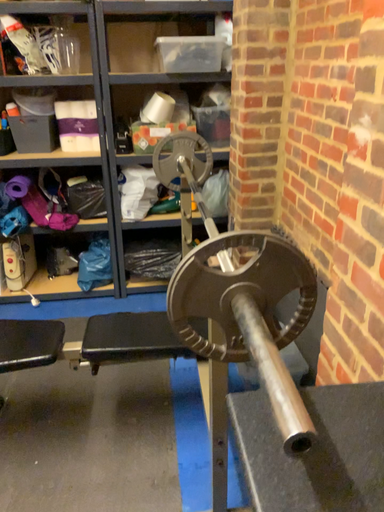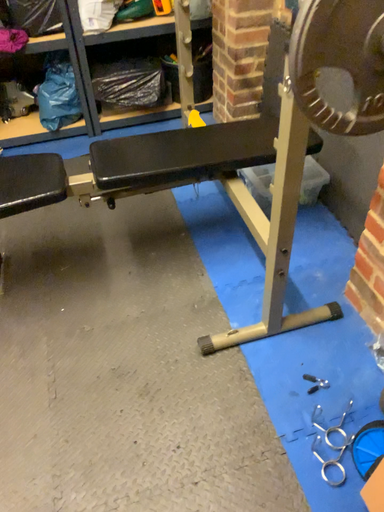
Question: Which way did the camera rotate in the video?

Choices:
 (A) rotated downward
 (B) rotated upward

Answer: (A)